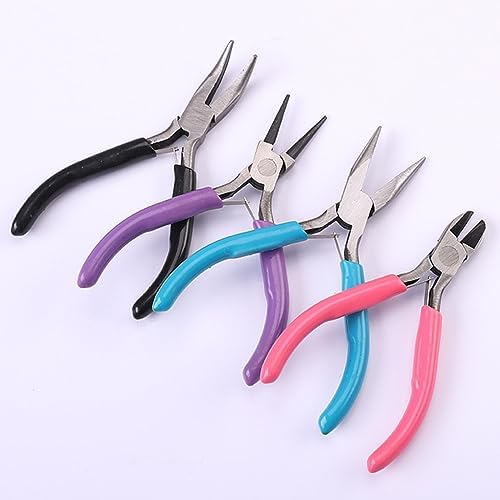
Locate an element on the screen. This screenshot has height=500, width=500. tension bars is located at coordinates (433, 275), (334, 241), (246, 200), (179, 153).